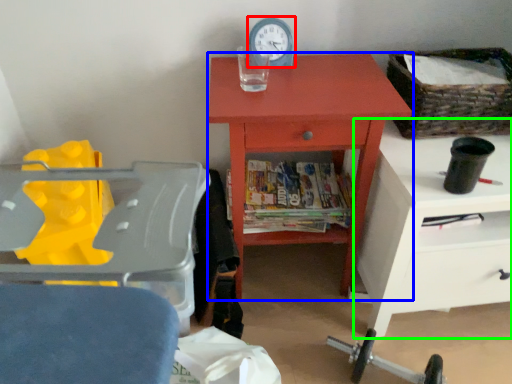
Question: Estimate the real-world distances between objects in this image. Which object is farther from clock (highlighted by a red box), chest of drawers (highlighted by a blue box) or nightstand (highlighted by a green box)?

Choices:
 (A) chest of drawers
 (B) nightstand

Answer: (B)